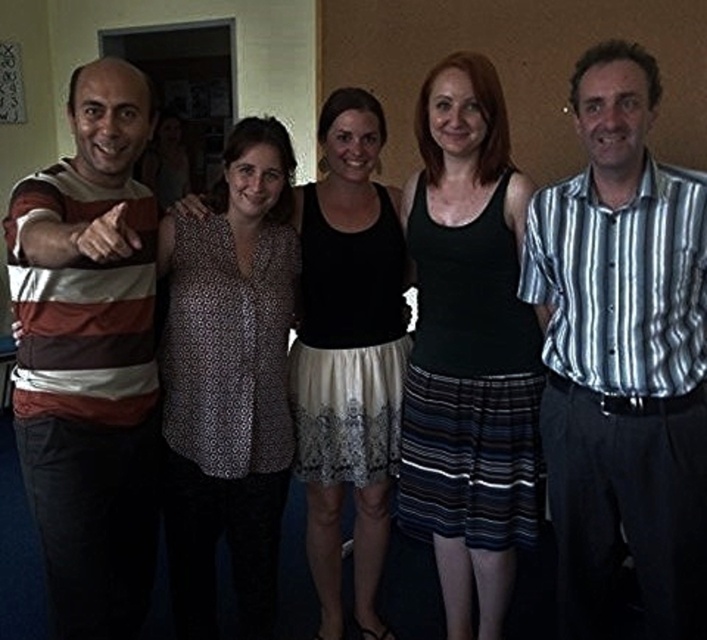
Which is more to the left, striped cotton shirt at left or printed fabric blouse at center?

striped cotton shirt at left is more to the left.

Is striped cotton shirt at left to the right of printed fabric blouse at center from the viewer's perspective?

Incorrect, striped cotton shirt at left is not on the right side of printed fabric blouse at center.

You are a GUI agent. You are given a task and a screenshot of the screen. Output one action in this format:
    pyautogui.click(x=<x>, y=<y>)
    Task: Click on the striped cotton shirt at left
    Image resolution: width=707 pixels, height=640 pixels.
    Given the screenshot: What is the action you would take?
    pyautogui.click(x=88, y=356)

Can you confirm if printed fabric blouse at center is bigger than patterned fabric blouse at center?

No, printed fabric blouse at center is not bigger than patterned fabric blouse at center.

Is point (180, 625) positioned after point (350, 145)?

That is True.

The width and height of the screenshot is (707, 640). Find the location of `printed fabric blouse at center`. printed fabric blouse at center is located at coordinates (228, 381).

Identify the location of printed fabric blouse at center. (228, 381).

Can you confirm if striped cotton shirt at left is positioned below patterned fabric blouse at center?

Indeed, striped cotton shirt at left is positioned under patterned fabric blouse at center.

Image resolution: width=707 pixels, height=640 pixels. What do you see at coordinates (88, 356) in the screenshot?
I see `striped cotton shirt at left` at bounding box center [88, 356].

I want to click on striped cotton shirt at left, so click(88, 356).